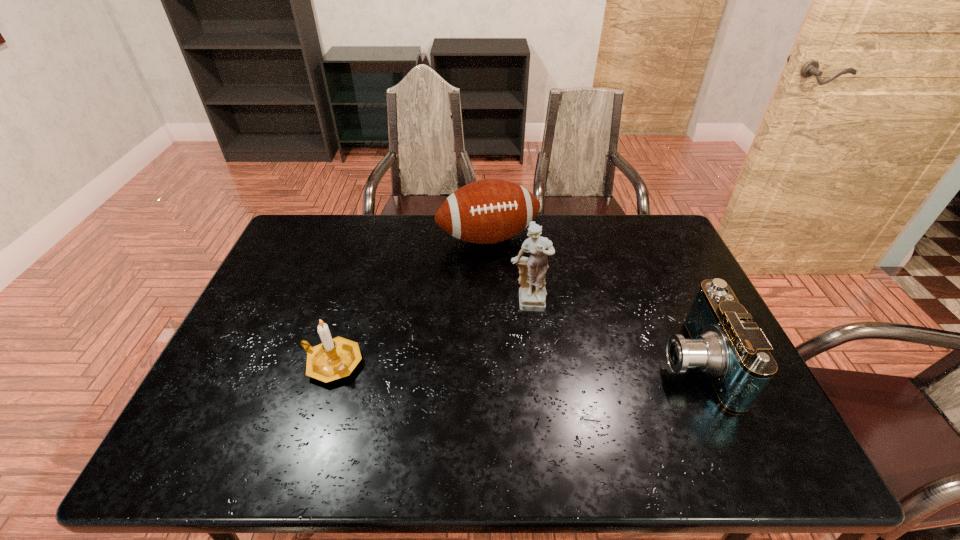
I want to click on free space between the leftmost object and the farthest object, so click(x=410, y=300).

The height and width of the screenshot is (540, 960). I want to click on vacant space in between the rightmost object and the figurine, so click(x=611, y=334).

At what (x,y) coordinates should I click in order to perform the action: click on free spot between the football and the leftmost object. Please return your answer as a coordinate pair (x, y). The image size is (960, 540). Looking at the image, I should click on (410, 300).

Locate an element on the screen. Image resolution: width=960 pixels, height=540 pixels. empty space between the football and the figurine is located at coordinates (508, 272).

Where is `vacant region between the rightmost object and the tallest object`? The image size is (960, 540). vacant region between the rightmost object and the tallest object is located at coordinates (611, 334).

The image size is (960, 540). I want to click on empty space that is in between the leftmost object and the tallest object, so click(430, 334).

You are a GUI agent. You are given a task and a screenshot of the screen. Output one action in this format:
    pyautogui.click(x=<x>, y=<y>)
    Task: Click on the free space between the candle holder and the tallest object
    
    Given the screenshot: What is the action you would take?
    pyautogui.click(x=430, y=334)

Identify the location of empty space that is in between the farthest object and the candle holder. (410, 300).

Where is `object that is the third closest to the leftmost object`? This screenshot has width=960, height=540. object that is the third closest to the leftmost object is located at coordinates (724, 343).

Locate an element on the screen. This screenshot has width=960, height=540. object that is the third nearest to the tallest object is located at coordinates (336, 358).